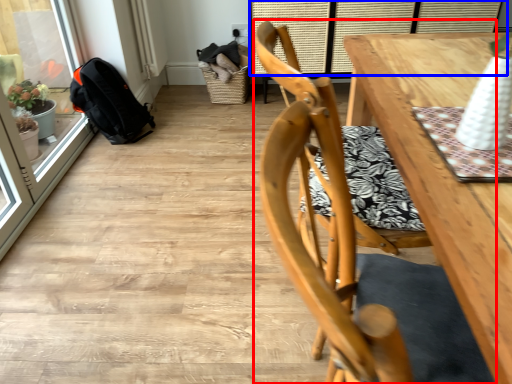
Question: Among these objects, which one is nearest to the camera, chair (highlighted by a red box) or window (highlighted by a blue box)?

Choices:
 (A) chair
 (B) window

Answer: (A)